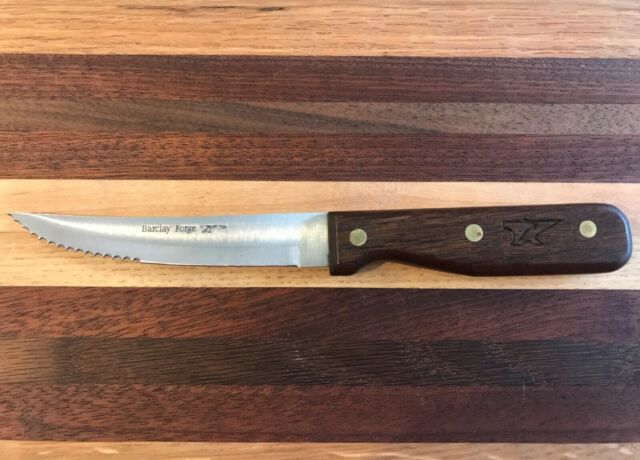
Identify the location of handle. The width and height of the screenshot is (640, 460). (422, 233).